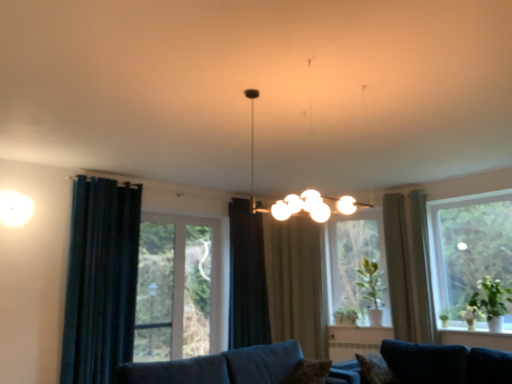
Question: Considering the positions of point (285, 306) and point (377, 367), is point (285, 306) closer or farther from the camera than point (377, 367)?

Choices:
 (A) closer
 (B) farther

Answer: (B)

Question: In the image, is beige fabric curtain at center, which is the 3th curtain in left-to-right order, on the left side or the right side of brown textured pillow at lower right, arranged as the 1th pillow when viewed from the right?

Choices:
 (A) left
 (B) right

Answer: (A)

Question: Which of these objects is positioned farthest from the dark blue fabric curtain at left, which appears as the first curtain when viewed from the left?

Choices:
 (A) black fabric curtain at center, which ranks as the 4th curtain in right-to-left order
 (B) beige fabric curtain at right, arranged as the 1th curtain when viewed from the right
 (C) clear glass window at center, positioned as the 2th window in left-to-right order
 (D) velvet blue couch at lower center, the second studio couch when ordered from right to left
 (E) transparent glass window at right, the 3th window viewed from the left

Answer: (E)

Question: Which of these objects is positioned farthest from the brown textured pillow at lower right, arranged as the 1th pillow when viewed from the right?

Choices:
 (A) dark blue fabric curtain at left, acting as the fifth curtain starting from the right
 (B) clear glass window at center, the 3th window positioned from the right
 (C) transparent glass window at right, the 3th window viewed from the left
 (D) clear glass window at center, which is the 2th window from right to left
 (E) brown textured pillow at lower center, which appears as the 1th pillow when viewed from the left

Answer: (A)